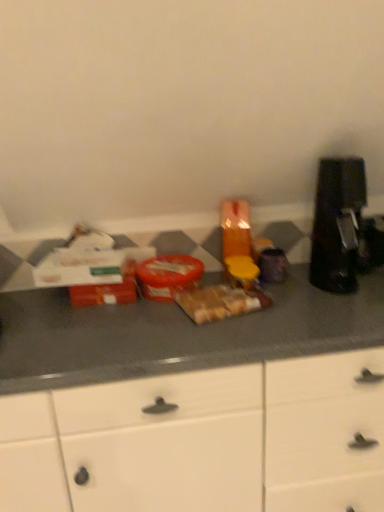
Question: Is brown matte sandwich at center, marked as the second food in a left-to-right arrangement, located within matte plastic container at center, placed as the 1th food when sorted from left to right?

Choices:
 (A) yes
 (B) no

Answer: (B)

Question: From the image's perspective, would you say matte plastic container at center, placed as the 1th food when sorted from left to right, is shown under brown matte sandwich at center, marked as the second food in a left-to-right arrangement?

Choices:
 (A) no
 (B) yes

Answer: (A)

Question: Does matte plastic container at center, placed as the 1th food when sorted from left to right, have a greater height compared to brown matte sandwich at center, marked as the second food in a left-to-right arrangement?

Choices:
 (A) no
 (B) yes

Answer: (B)

Question: Is matte plastic container at center, marked as the second food in a right-to-left arrangement, facing away from brown matte sandwich at center, positioned as the 1th food in right-to-left order?

Choices:
 (A) yes
 (B) no

Answer: (B)

Question: Does matte plastic container at center, marked as the second food in a right-to-left arrangement, have a larger size compared to brown matte sandwich at center, positioned as the 1th food in right-to-left order?

Choices:
 (A) yes
 (B) no

Answer: (A)

Question: Which is correct: white matte cabinet at center is inside brown matte sandwich at center, positioned as the 1th food in right-to-left order, or outside of it?

Choices:
 (A) inside
 (B) outside

Answer: (B)

Question: In the image, is white matte cabinet at center positioned in front of or behind brown matte sandwich at center, positioned as the 1th food in right-to-left order?

Choices:
 (A) front
 (B) behind

Answer: (A)

Question: Looking at the image, does white matte cabinet at center seem bigger or smaller compared to brown matte sandwich at center, positioned as the 1th food in right-to-left order?

Choices:
 (A) big
 (B) small

Answer: (A)

Question: Is point [x=302, y=432] positioned closer to the camera than point [x=243, y=300]?

Choices:
 (A) closer
 (B) farther

Answer: (A)

Question: Is matte plastic container at center, marked as the second food in a right-to-left arrangement, wider or thinner than black plastic coffee machine at right?

Choices:
 (A) thin
 (B) wide

Answer: (B)

Question: Considering their positions, is matte plastic container at center, marked as the second food in a right-to-left arrangement, located in front of or behind black plastic coffee machine at right?

Choices:
 (A) behind
 (B) front

Answer: (A)

Question: Considering the positions of matte plastic container at center, marked as the second food in a right-to-left arrangement, and black plastic coffee machine at right in the image, is matte plastic container at center, marked as the second food in a right-to-left arrangement, bigger or smaller than black plastic coffee machine at right?

Choices:
 (A) small
 (B) big

Answer: (A)

Question: From the image's perspective, is matte plastic container at center, placed as the 1th food when sorted from left to right, located above or below black plastic coffee machine at right?

Choices:
 (A) above
 (B) below

Answer: (B)

Question: Is brown matte sandwich at center, positioned as the 1th food in right-to-left order, to the left or to the right of white matte cabinet at center in the image?

Choices:
 (A) left
 (B) right

Answer: (B)

Question: In the image, is brown matte sandwich at center, positioned as the 1th food in right-to-left order, positioned in front of or behind white matte cabinet at center?

Choices:
 (A) behind
 (B) front

Answer: (A)